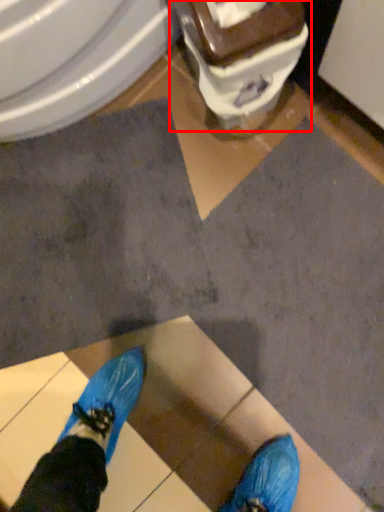
Question: In this image, where is toilet (annotated by the red box) located relative to bidet?

Choices:
 (A) left
 (B) right

Answer: (B)